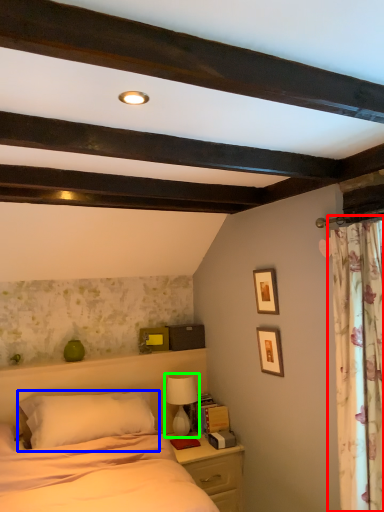
Question: Estimate the real-world distances between objects in this image. Which object is closer to curtain (highlighted by a red box), pillow (highlighted by a blue box) or table lamp (highlighted by a green box)?

Choices:
 (A) pillow
 (B) table lamp

Answer: (A)